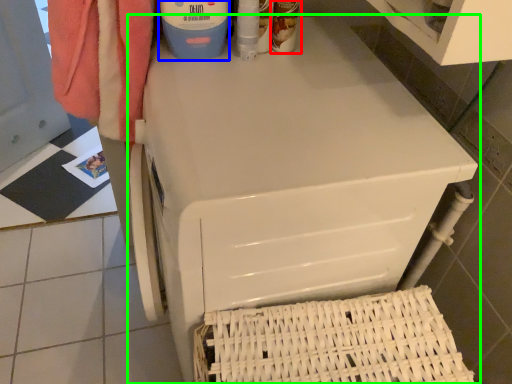
Question: Which object is the farthest from cleaning product (highlighted by a red box)? Choose among these: cleaning product (highlighted by a blue box) or home appliance (highlighted by a green box).

Choices:
 (A) cleaning product
 (B) home appliance

Answer: (B)